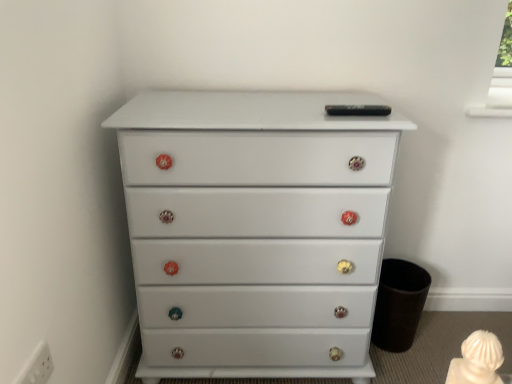
What do you see at coordinates (255, 227) in the screenshot? The width and height of the screenshot is (512, 384). I see `white glossy chest of drawers at center` at bounding box center [255, 227].

Locate an element on the screen. The height and width of the screenshot is (384, 512). white glossy chest of drawers at center is located at coordinates (255, 227).

Identify the location of white plastic electric outlet at lower left. (36, 366).

The image size is (512, 384). What do you see at coordinates (36, 366) in the screenshot?
I see `white plastic electric outlet at lower left` at bounding box center [36, 366].

What is the approximate width of white plastic electric outlet at lower left?

0.77 inches.

Identify the location of white glossy chest of drawers at center. (255, 227).

Is white glossy chest of drawers at center to the left of white plastic electric outlet at lower left from the viewer's perspective?

No, white glossy chest of drawers at center is not to the left of white plastic electric outlet at lower left.

Is white glossy chest of drawers at center positioned behind white plastic electric outlet at lower left?

Yes.

Between point (178, 273) and point (37, 355), which one is positioned in front?

The point (37, 355) is closer to the camera.

From the image's perspective, which one is positioned lower, white glossy chest of drawers at center or white plastic electric outlet at lower left?

white plastic electric outlet at lower left, from the image's perspective.

From a real-world perspective, which object rests below the other?

white glossy chest of drawers at center, from a real-world perspective.

Based on the photo, between white glossy chest of drawers at center and white plastic electric outlet at lower left, which one has larger width?

white glossy chest of drawers at center is wider.

Is white glossy chest of drawers at center shorter than white plastic electric outlet at lower left?

Incorrect, the height of white glossy chest of drawers at center does not fall short of that of white plastic electric outlet at lower left.

Based on their sizes in the image, would you say white glossy chest of drawers at center is bigger or smaller than white plastic electric outlet at lower left?

Clearly, white glossy chest of drawers at center is larger in size than white plastic electric outlet at lower left.

Is white glossy chest of drawers at center not within white plastic electric outlet at lower left?

Yes, white glossy chest of drawers at center is located beyond the bounds of white plastic electric outlet at lower left.

Can you see white glossy chest of drawers at center touching white plastic electric outlet at lower left?

No, white glossy chest of drawers at center is not in contact with white plastic electric outlet at lower left.

In the scene shown: Could you tell me if white glossy chest of drawers at center is facing white plastic electric outlet at lower left?

Yes, white glossy chest of drawers at center is aimed at white plastic electric outlet at lower left.

How different are the orientations of white glossy chest of drawers at center and white plastic electric outlet at lower left in degrees?

The facing directions of white glossy chest of drawers at center and white plastic electric outlet at lower left are 89.4 degrees apart.

How distant is white glossy chest of drawers at center from white plastic electric outlet at lower left?

They are 62.50 centimeters apart.

The width and height of the screenshot is (512, 384). In order to click on electric outlet in front of the white glossy chest of drawers at center in this screenshot , I will do `click(36, 366)`.

Can you confirm if white plastic electric outlet at lower left is positioned to the left of white glossy chest of drawers at center?

Yes, white plastic electric outlet at lower left is to the left of white glossy chest of drawers at center.

Is white plastic electric outlet at lower left positioned before white glossy chest of drawers at center?

Yes, white plastic electric outlet at lower left is closer to the camera.

Which point is more distant from viewer, (22, 369) or (268, 170)?

Positioned behind is point (268, 170).

Based on the photo, from the image's perspective, between white plastic electric outlet at lower left and white glossy chest of drawers at center, who is located below?

white plastic electric outlet at lower left is shown below in the image.

From a real-world perspective, is white plastic electric outlet at lower left on white glossy chest of drawers at center?

Indeed, from a real-world perspective, white plastic electric outlet at lower left stands above white glossy chest of drawers at center.

Looking at this image, looking at their sizes, would you say white plastic electric outlet at lower left is wider or thinner than white glossy chest of drawers at center?

white plastic electric outlet at lower left is thinner than white glossy chest of drawers at center.

Can you confirm if white plastic electric outlet at lower left is taller than white glossy chest of drawers at center?

No.

Is white plastic electric outlet at lower left bigger or smaller than white glossy chest of drawers at center?

Clearly, white plastic electric outlet at lower left is smaller in size than white glossy chest of drawers at center.

In the scene shown: Does white plastic electric outlet at lower left contain white glossy chest of drawers at center?

That's incorrect, white glossy chest of drawers at center is not inside white plastic electric outlet at lower left.

Are white plastic electric outlet at lower left and white glossy chest of drawers at center located far from each other?

No, white plastic electric outlet at lower left is not far away from white glossy chest of drawers at center.

Could you tell me if white plastic electric outlet at lower left is turned towards white glossy chest of drawers at center?

No, white plastic electric outlet at lower left does not turn towards white glossy chest of drawers at center.

How many degrees apart are the facing directions of white plastic electric outlet at lower left and white glossy chest of drawers at center?

The angular difference between white plastic electric outlet at lower left and white glossy chest of drawers at center is 89.4 degrees.

The width and height of the screenshot is (512, 384). Identify the location of electric outlet above the white glossy chest of drawers at center (from a real-world perspective). (36, 366).

You are a GUI agent. You are given a task and a screenshot of the screen. Output one action in this format:
    pyautogui.click(x=<x>, y=<y>)
    Task: Click on the chest of drawers that appears above the white plastic electric outlet at lower left (from the image's perspective)
    
    Given the screenshot: What is the action you would take?
    pyautogui.click(x=255, y=227)

This screenshot has width=512, height=384. Identify the location of electric outlet below the white glossy chest of drawers at center (from the image's perspective). (36, 366).